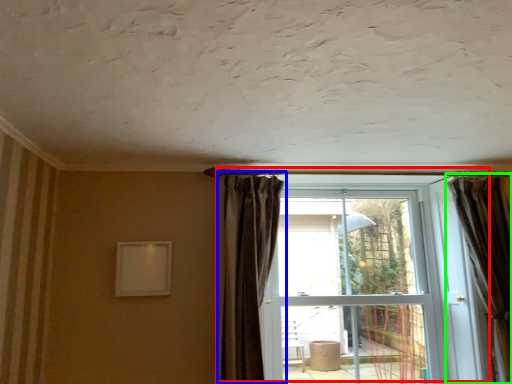
Question: Considering the real-world distances, which object is closest to door (highlighted by a red box)? curtain (highlighted by a blue box) or curtain (highlighted by a green box).

Choices:
 (A) curtain
 (B) curtain

Answer: (B)